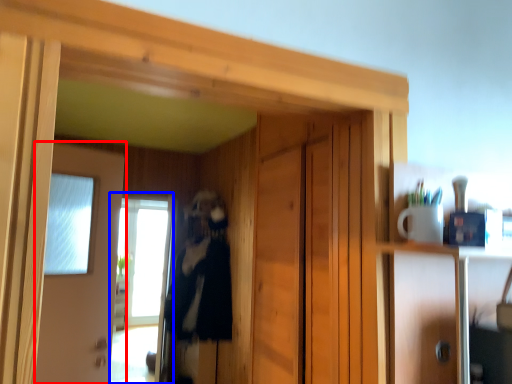
Question: Which of the following is the farthest to the observer, door (highlighted by a red box) or screen door (highlighted by a blue box)?

Choices:
 (A) door
 (B) screen door

Answer: (B)